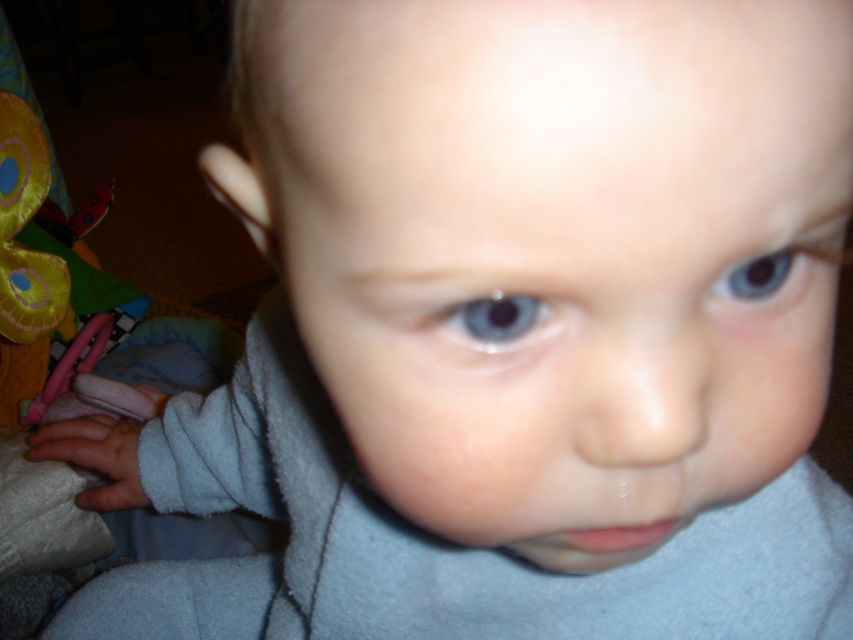
Is blue glossy eye at center taller than blue glossy eye at upper center?

No.

Who is lower down, blue glossy eye at center or blue glossy eye at upper center?

blue glossy eye at center

This screenshot has width=853, height=640. What do you see at coordinates (492, 321) in the screenshot? I see `blue glossy eye at center` at bounding box center [492, 321].

Where is `blue glossy eye at center`? blue glossy eye at center is located at coordinates (492, 321).